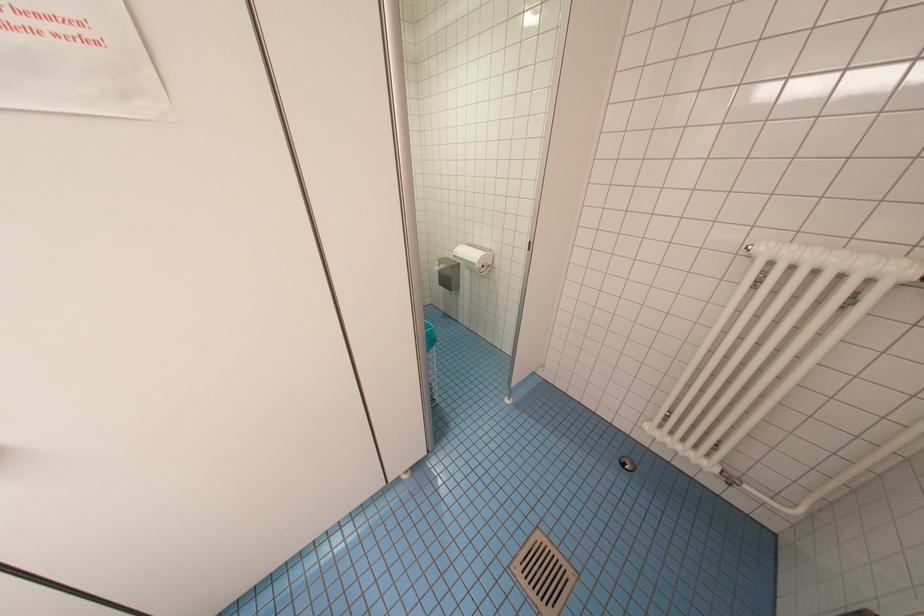
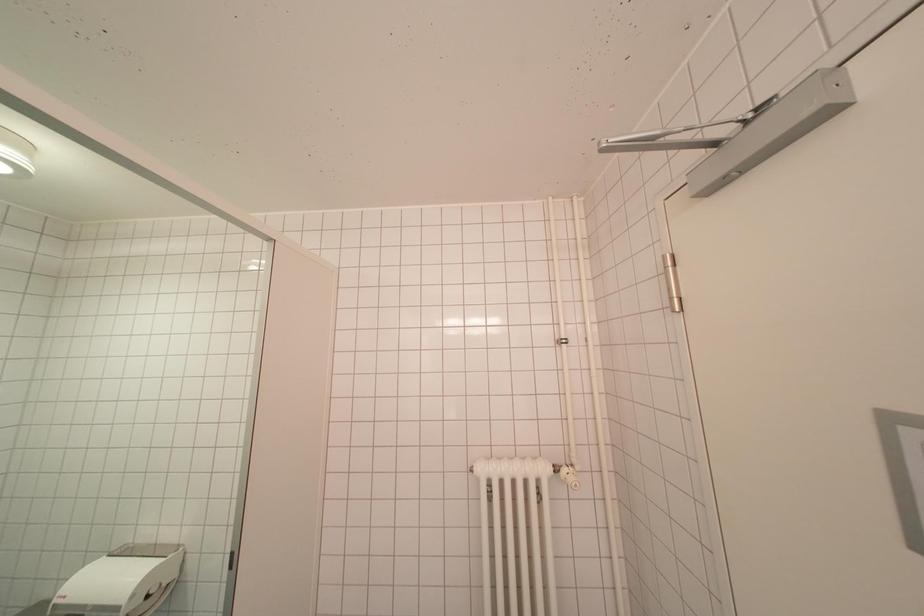
In the scene shown: Based on the continuous images, in which direction is the camera rotating?

The rotation direction of the camera is right-up.